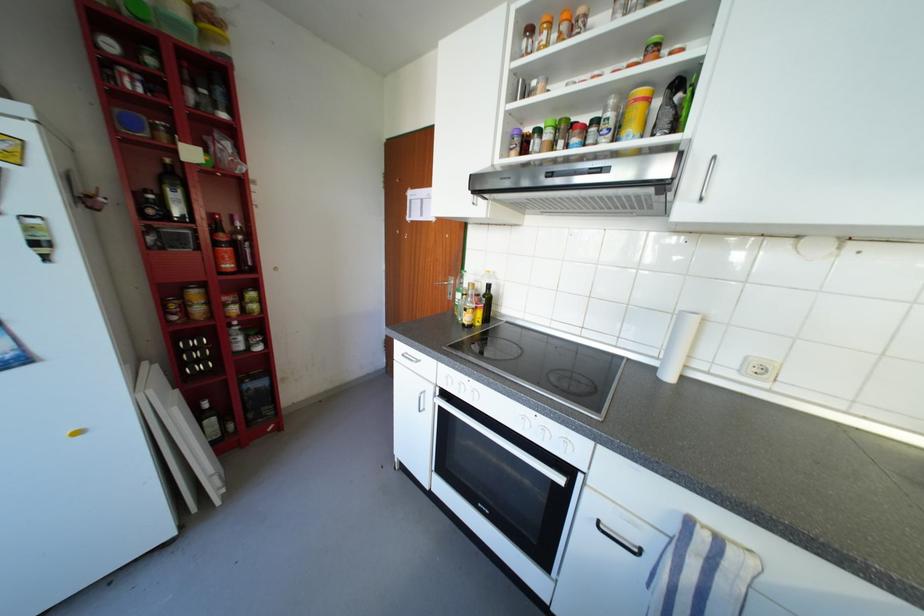
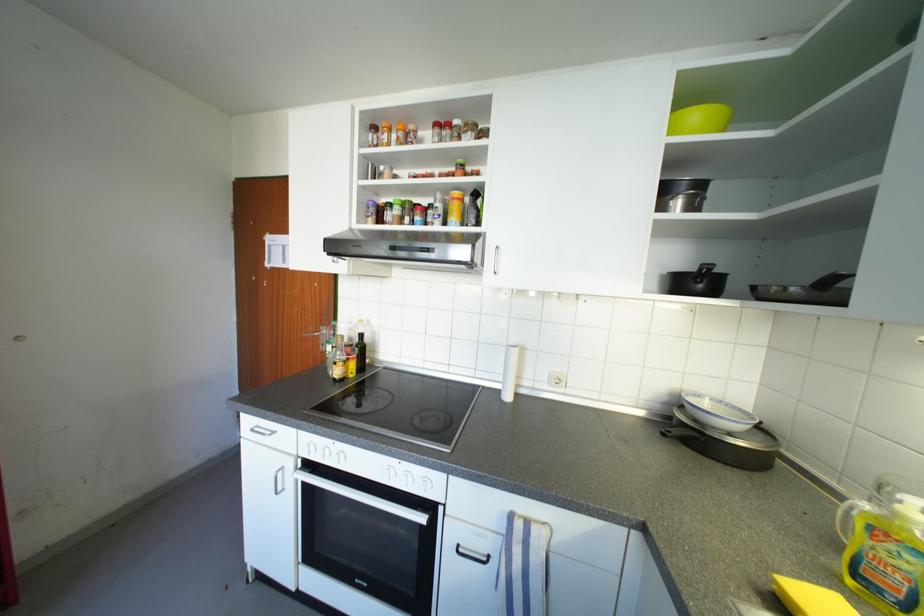
The point at (530,44) is marked in the first image. Where is the corresponding point in the second image?

(377, 138)